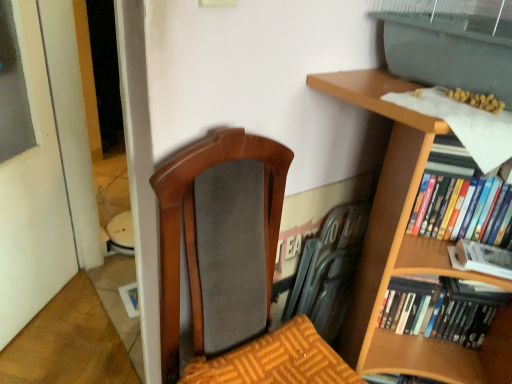
Question: In terms of height, does white matte book at right, positioned as the second book in top-to-bottom order, look taller or shorter compared to matte black swivel chair at center?

Choices:
 (A) short
 (B) tall

Answer: (A)

Question: From the image's perspective, is white matte book at right, positioned as the second book in top-to-bottom order, above or below matte black swivel chair at center?

Choices:
 (A) above
 (B) below

Answer: (B)

Question: Which object is positioned closest to the matte black swivel chair at center?

Choices:
 (A) hardcover books at right, acting as the first book starting from the bottom
 (B) white matte book at right, the second book ordered from the bottom
 (C) hardcover books at right, positioned as the first book in top-to-bottom order

Answer: (A)

Question: Which object is positioned closest to the white matte book at right, positioned as the second book in top-to-bottom order?

Choices:
 (A) matte black swivel chair at center
 (B) hardcover books at right, which is the third book in bottom-to-top order
 (C) hardcover books at right, marked as the third book in a top-to-bottom arrangement

Answer: (B)